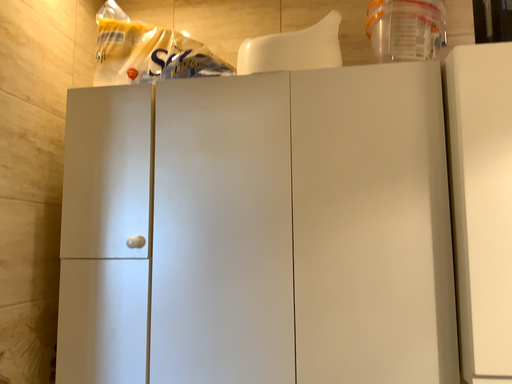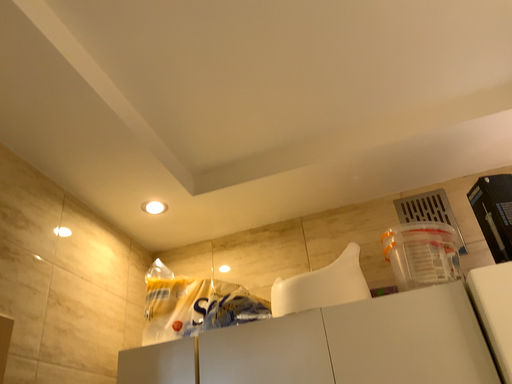
Question: How did the camera likely rotate when shooting the video?

Choices:
 (A) rotated left
 (B) rotated right

Answer: (A)